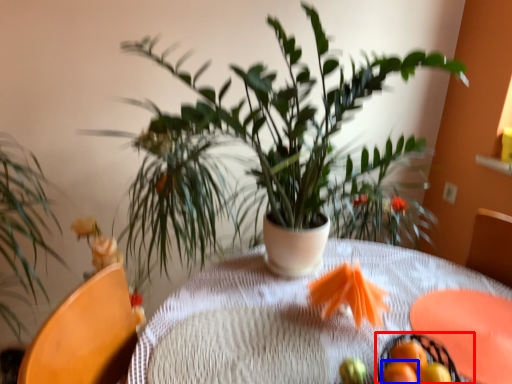
Question: Which object is further to the camera taking this photo, basket (highlighted by a red box) or tangerine (highlighted by a blue box)?

Choices:
 (A) basket
 (B) tangerine

Answer: (B)